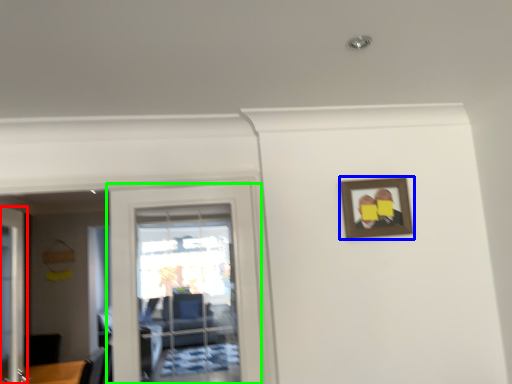
Question: Based on their relative distances, which object is farther from door (highlighted by a red box)? Choose from picture frame (highlighted by a blue box) and door (highlighted by a green box).

Choices:
 (A) picture frame
 (B) door

Answer: (A)